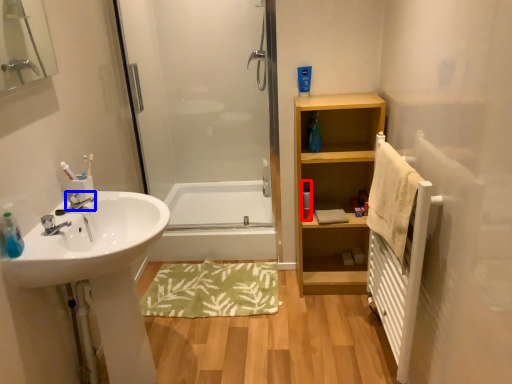
Question: Which object appears farthest to the camera in this image, toiletry (highlighted by a red box) or tap (highlighted by a blue box)?

Choices:
 (A) toiletry
 (B) tap

Answer: (A)